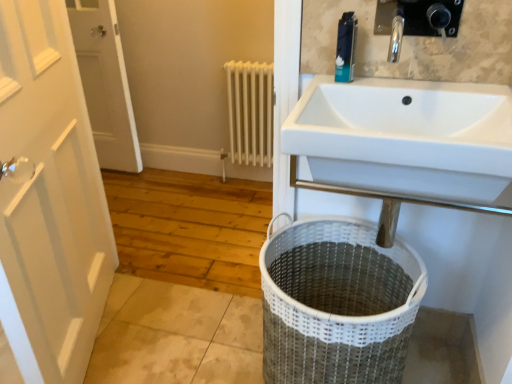
Find the location of `free spot above white wooden door at left, placed as the first door when sorted from back to front (from a real-world perspective)`. free spot above white wooden door at left, placed as the first door when sorted from back to front (from a real-world perspective) is located at coordinates (89, 1).